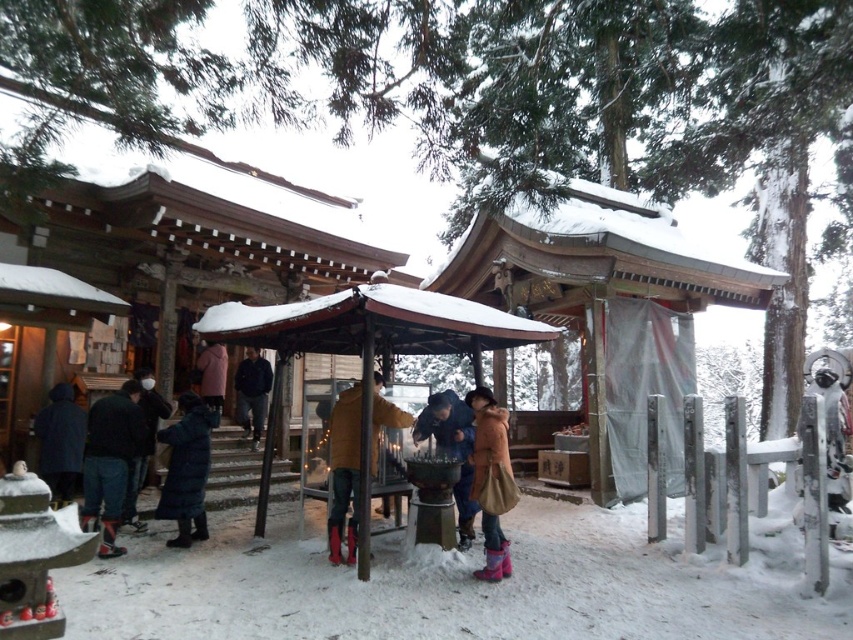
You are standing at the shrine and want to place a small offering at the closest point between point (368, 433) and point (450, 388). Which point should you go to?

Point (368, 433) is closer to the viewer than point (450, 388), so you should go to point (368, 433) to place your offering.

You are standing at the point marked by the coordinates point (372, 339) in the winter scene. What structure are you currently standing on?

The point (372, 339) indicates a brown wooden gazebo at center, so you are standing on the brown wooden gazebo at center.